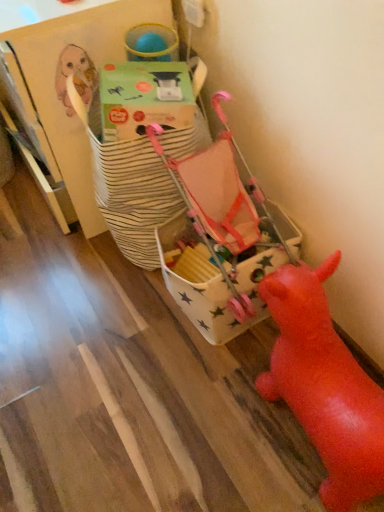
Question: Can you confirm if white star-patterned fabric bag at center, which is the second toy in front-to-back order, is wider than green cardboard box at upper center?

Choices:
 (A) no
 (B) yes

Answer: (B)

Question: Is white star-patterned fabric bag at center, which is the second toy in front-to-back order, thinner than green cardboard box at upper center?

Choices:
 (A) no
 (B) yes

Answer: (A)

Question: Is white star-patterned fabric bag at center, the 1th toy from the back, next to green cardboard box at upper center?

Choices:
 (A) no
 (B) yes

Answer: (A)

Question: Is white star-patterned fabric bag at center, the 1th toy from the back, shorter than green cardboard box at upper center?

Choices:
 (A) no
 (B) yes

Answer: (A)

Question: Is green cardboard box at upper center at the back of white star-patterned fabric bag at center, which is the second toy in front-to-back order?

Choices:
 (A) no
 (B) yes

Answer: (A)

Question: From the image's perspective, is rubber red pig at lower right, the 1th toy in the front-to-back sequence, positioned above or below white star-patterned fabric bag at center, the 1th toy from the back?

Choices:
 (A) below
 (B) above

Answer: (A)

Question: Choose the correct answer: Is rubber red pig at lower right, acting as the second toy starting from the back, inside white star-patterned fabric bag at center, the 1th toy from the back, or outside it?

Choices:
 (A) outside
 (B) inside

Answer: (A)

Question: Considering the positions of point (337, 253) and point (261, 317), is point (337, 253) closer or farther from the camera than point (261, 317)?

Choices:
 (A) closer
 (B) farther

Answer: (A)

Question: From their relative heights in the image, would you say rubber red pig at lower right, the 1th toy in the front-to-back sequence, is taller or shorter than white star-patterned fabric bag at center, the 1th toy from the back?

Choices:
 (A) tall
 (B) short

Answer: (A)

Question: Is point (271, 256) closer or farther from the camera than point (337, 487)?

Choices:
 (A) closer
 (B) farther

Answer: (B)

Question: From the image's perspective, relative to rubber red pig at lower right, acting as the second toy starting from the back, is white star-patterned fabric bag at center, which is the second toy in front-to-back order, above or below?

Choices:
 (A) below
 (B) above

Answer: (B)

Question: Considering their positions, is white star-patterned fabric bag at center, which is the second toy in front-to-back order, located in front of or behind rubber red pig at lower right, the 1th toy in the front-to-back sequence?

Choices:
 (A) behind
 (B) front

Answer: (A)

Question: From a real-world perspective, is white star-patterned fabric bag at center, the 1th toy from the back, physically located above or below rubber red pig at lower right, the 1th toy in the front-to-back sequence?

Choices:
 (A) above
 (B) below

Answer: (B)

Question: From the image's perspective, is green cardboard box at upper center above or below white star-patterned fabric bag at center, which is the second toy in front-to-back order?

Choices:
 (A) above
 (B) below

Answer: (A)

Question: Considering their positions, is green cardboard box at upper center located in front of or behind white star-patterned fabric bag at center, the 1th toy from the back?

Choices:
 (A) front
 (B) behind

Answer: (A)